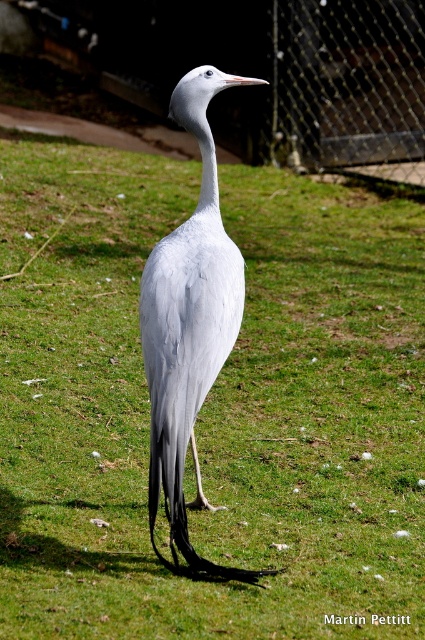
Question: Which point appears closest to the camera in this image?

Choices:
 (A) (306, 74)
 (B) (218, 300)

Answer: (B)

Question: Can you confirm if gray matte bird at center is wider than metal mesh fence at upper right?

Choices:
 (A) yes
 (B) no

Answer: (B)

Question: Is gray matte bird at center further to camera compared to metal mesh fence at upper right?

Choices:
 (A) yes
 (B) no

Answer: (B)

Question: Is gray matte bird at center positioned at the back of metal mesh fence at upper right?

Choices:
 (A) yes
 (B) no

Answer: (B)

Question: Which object appears farthest from the camera in this image?

Choices:
 (A) metal mesh fence at upper right
 (B) gray matte bird at center

Answer: (A)